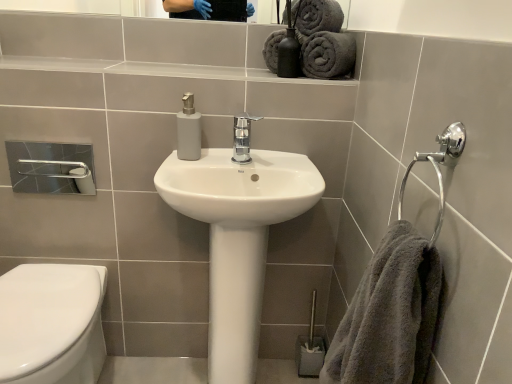
Question: Is metallic silver toilet brush at lower right looking in the opposite direction of gray fluffy towel at right?

Choices:
 (A) yes
 (B) no

Answer: (B)

Question: From a real-world perspective, is metallic silver toilet brush at lower right over gray fluffy towel at right?

Choices:
 (A) yes
 (B) no

Answer: (B)

Question: Can we say metallic silver toilet brush at lower right lies outside gray fluffy towel at right?

Choices:
 (A) no
 (B) yes

Answer: (B)

Question: Is metallic silver toilet brush at lower right facing towards gray fluffy towel at right?

Choices:
 (A) no
 (B) yes

Answer: (A)

Question: Is gray fluffy towel at right completely or partially inside metallic silver toilet brush at lower right?

Choices:
 (A) no
 (B) yes

Answer: (A)

Question: From the image's perspective, is matte gray soap dispenser at center located above or below gray fluffy towel at right?

Choices:
 (A) below
 (B) above

Answer: (B)

Question: Does point pos(183,140) appear closer or farther from the camera than point pos(407,276)?

Choices:
 (A) closer
 (B) farther

Answer: (B)

Question: Considering the positions of matte gray soap dispenser at center and gray fluffy towel at right in the image, is matte gray soap dispenser at center wider or thinner than gray fluffy towel at right?

Choices:
 (A) wide
 (B) thin

Answer: (B)

Question: In the image, is matte gray soap dispenser at center positioned in front of or behind gray fluffy towel at right?

Choices:
 (A) behind
 (B) front

Answer: (A)

Question: From their relative heights in the image, would you say matte gray soap dispenser at center is taller or shorter than clear glass mirror at upper center?

Choices:
 (A) tall
 (B) short

Answer: (A)

Question: Considering the relative positions of matte gray soap dispenser at center and clear glass mirror at upper center in the image provided, is matte gray soap dispenser at center to the left or to the right of clear glass mirror at upper center?

Choices:
 (A) left
 (B) right

Answer: (B)

Question: Is point (189, 137) positioned closer to the camera than point (115, 13)?

Choices:
 (A) farther
 (B) closer

Answer: (B)

Question: Is matte gray soap dispenser at center in front of or behind clear glass mirror at upper center in the image?

Choices:
 (A) behind
 (B) front

Answer: (B)

Question: From their relative heights in the image, would you say white glossy toilet at lower left is taller or shorter than clear glass mirror at upper center?

Choices:
 (A) short
 (B) tall

Answer: (B)

Question: Is white glossy toilet at lower left wider or thinner than clear glass mirror at upper center?

Choices:
 (A) wide
 (B) thin

Answer: (A)